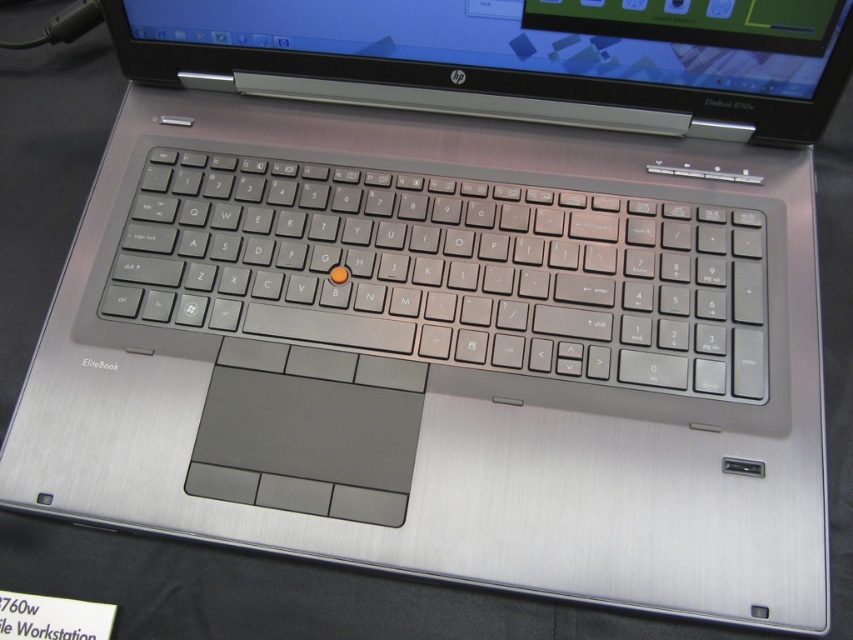
You are holding a ruler and want to measure the distance from your eyes to the satin silver keyboard at center. If the ruler shows 24 inches, is the keyboard closer or farther than the ruler measurement?

The satin silver keyboard at center is 24.21 inches from the viewer, so it is slightly farther than the 24 inches shown on the ruler.

Looking at this image, you are setting up a workspace and want to place a mouse next to the satin silver keyboard at center and the brushed metal laptop at upper center. Given their sizes, where should you place the mouse to ensure it fits comfortably without overlapping either device?

Since the satin silver keyboard at center has a lesser width compared to the brushed metal laptop at upper center, you should place the mouse to the right or left side of the satin silver keyboard at center, as there will be more space available there compared to the narrower area near the brushed metal laptop at upper center.

Based on the photo, you are setting up a new HP EliteBook laptop and need to connect a wireless mouse. The mouse requires a clear line of sight to the laptop. Since the brushed metal laptop at upper center and the satin silver keyboard at center are in your way, which object should you move to ensure the mouse has an unobstructed view?

You should move the satin silver keyboard at center because it is located below the brushed metal laptop at upper center, so moving the keyboard would provide a clear line of sight for the mouse.